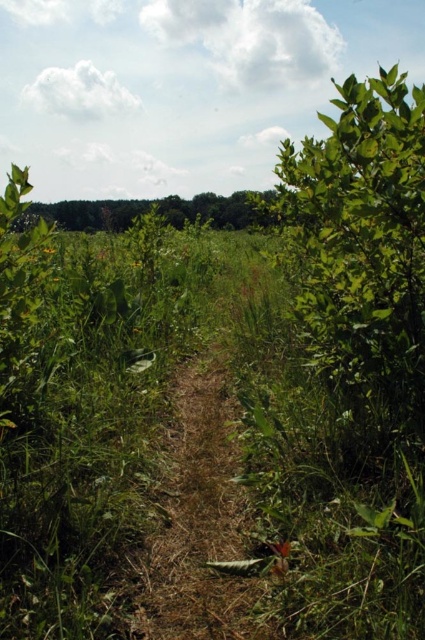
You are standing at point 0.5,0.5 in the meadow. You want to walk to the brown grassy dirt track at center. Which direction should you move to reach it?

The brown grassy dirt track at center is located at point (x=197, y=520). Since you are at point (x=212, y=320), you should move northeast to reach it.

Consider the image. You are standing at the point labeled point (206, 593) and want to walk towards the point labeled point (195, 214). Given that the path is narrow and bordered by vegetation, will you have to walk towards the camera or away from it to reach your destination?

Since point (206, 593) is closer to the camera than point (195, 214), you will need to walk away from the camera to reach your destination.

You are standing at the start of the brown grassy dirt track at center and want to reach the green leafy tree at upper center. Which direction should you walk to get closer to the tree?

You should walk forward along the brown grassy dirt track at center since it is closer to you than the green leafy tree at upper center, which is further away in the distance.